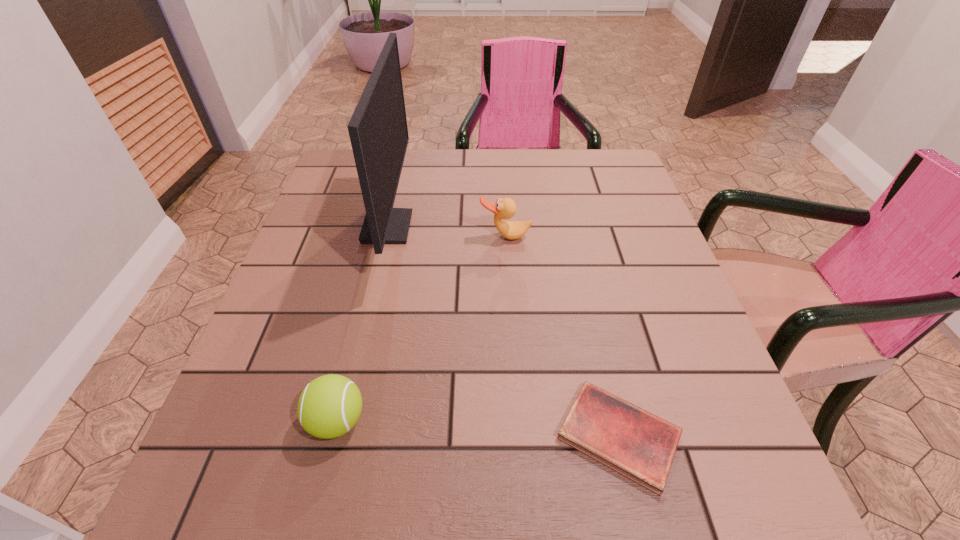
At what (x,y) coordinates should I click in order to perform the action: click on the tallest object. Please return your answer as a coordinate pair (x, y). Looking at the image, I should click on (378, 131).

This screenshot has width=960, height=540. I want to click on duck, so click(505, 208).

Where is `tennis ball`? tennis ball is located at coordinates (329, 406).

Locate an element on the screen. This screenshot has width=960, height=540. the shortest object is located at coordinates (641, 446).

In order to click on diary in this screenshot , I will do `click(641, 446)`.

Where is `vacant space located 0.100m on the front-facing side of the tallest object`? This screenshot has width=960, height=540. vacant space located 0.100m on the front-facing side of the tallest object is located at coordinates tap(452, 227).

You are a GUI agent. You are given a task and a screenshot of the screen. Output one action in this format:
    pyautogui.click(x=<x>, y=<y>)
    Task: Click on the vacant space located 0.390m on the beak of the third object from left to right
    This screenshot has width=960, height=540.
    Given the screenshot: What is the action you would take?
    pyautogui.click(x=516, y=394)

Where is `vacant space located on the right of the tennis ball`? vacant space located on the right of the tennis ball is located at coordinates (497, 421).

The width and height of the screenshot is (960, 540). In order to click on free space located on the back of the shortest object in this screenshot , I will do `click(574, 241)`.

Where is `object located at the far edge`? The height and width of the screenshot is (540, 960). object located at the far edge is located at coordinates (378, 131).